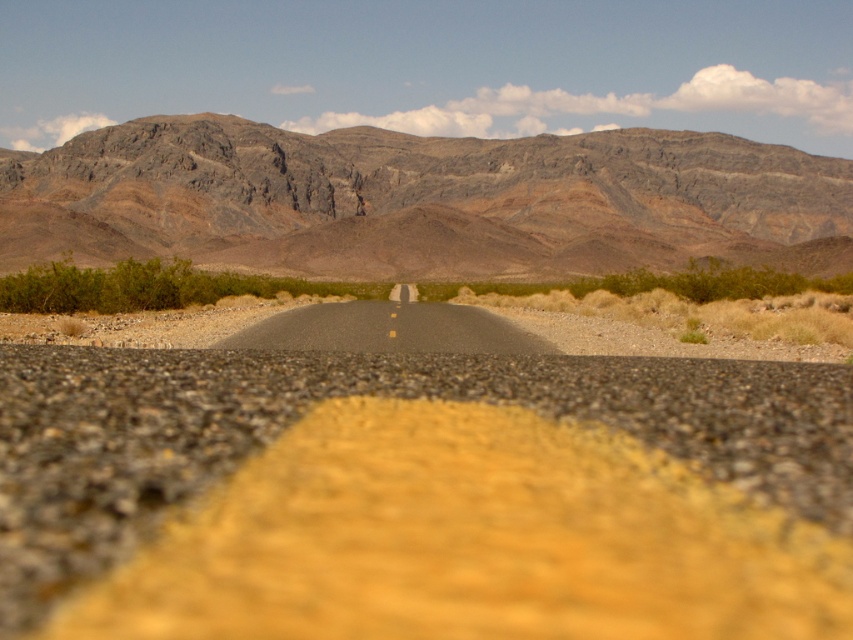
Question: Among these points, which one is nearest to the camera?

Choices:
 (A) (280, 400)
 (B) (253, 138)

Answer: (A)

Question: Considering the relative positions of smooth asphalt road at center and rugged rock mountain at center in the image provided, where is smooth asphalt road at center located with respect to rugged rock mountain at center?

Choices:
 (A) right
 (B) left

Answer: (B)

Question: Does smooth asphalt road at center appear under rugged rock mountain at center?

Choices:
 (A) yes
 (B) no

Answer: (A)

Question: Among these objects, which one is farthest from the camera?

Choices:
 (A) smooth asphalt road at center
 (B) rugged rock mountain at center

Answer: (B)

Question: Which of the following is the farthest from the observer?

Choices:
 (A) rugged rock mountain at center
 (B) smooth asphalt road at center

Answer: (A)

Question: Is the position of smooth asphalt road at center more distant than that of rugged rock mountain at center?

Choices:
 (A) no
 (B) yes

Answer: (A)